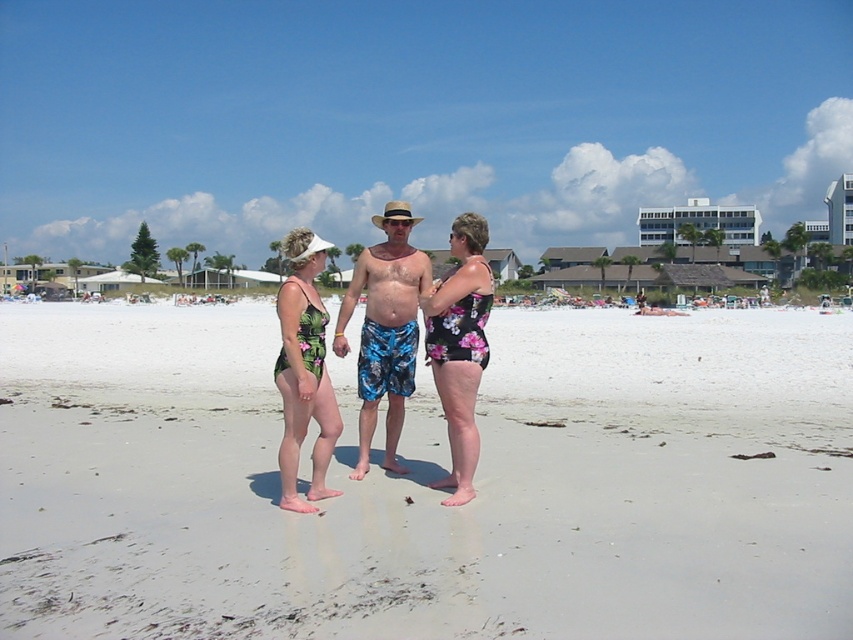
You are standing at the point marked as point (x=428, y=481). What is the terrain like at that location?

The terrain at point (x=428, y=481) is white sand at center.

You are a photographer trying to capture a group photo of the three people on the beach. You notice the floral print swimsuit at center and the green floral swimsuit at center. Which one should you focus on to ensure it appears higher in the photo?

The green floral swimsuit at center should be focused on to appear higher because it is positioned above the floral print swimsuit at center.

You are a photographer trying to capture a group photo of the three people on the beach. You want to ensure that the floral print swimsuit at center and the green floral swimsuit at center are both clearly visible in the frame. Given their sizes, which one should you focus on to ensure it doesn,t get lost in the background?

The floral print swimsuit at center is smaller in size compared to the green floral swimsuit at center. To ensure it doesn,t get lost in the background, focus on the green floral swimsuit at center since it is larger and more prominent.